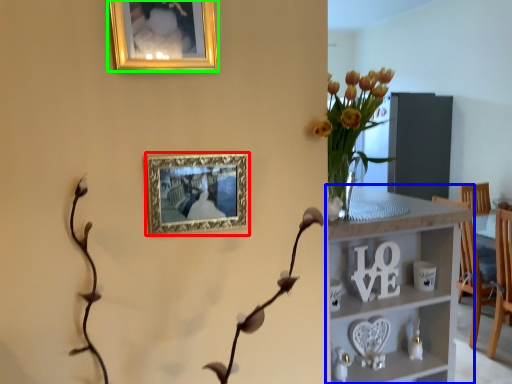
Question: Which is farther away from picture frame (highlighted by a red box)? shelf (highlighted by a blue box) or picture frame (highlighted by a green box)?

Choices:
 (A) shelf
 (B) picture frame

Answer: (A)